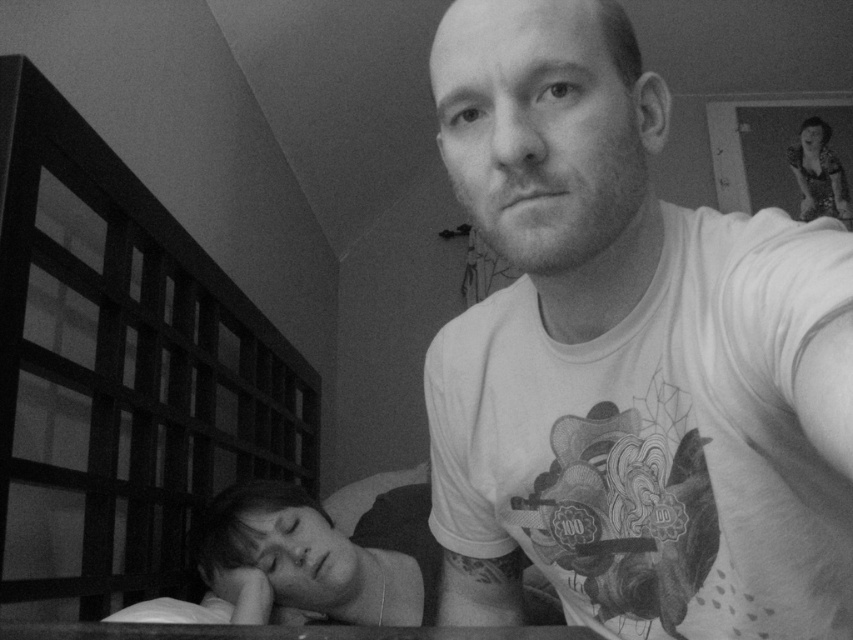
Identify the location of white cotton t-shirt at upper right. (630, 358).

Is white cotton t-shirt at upper right further to the viewer compared to shiny black dress at upper right?

No, white cotton t-shirt at upper right is closer to the viewer.

Image resolution: width=853 pixels, height=640 pixels. Identify the location of white cotton t-shirt at upper right. (630, 358).